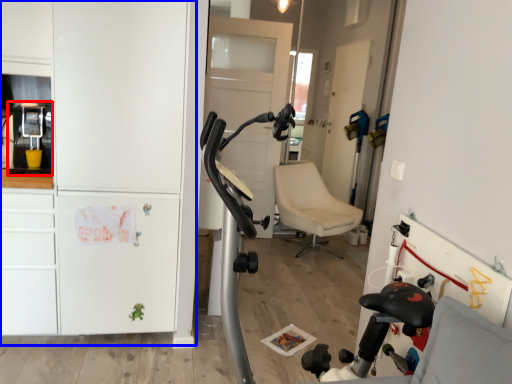
Question: Which object is closer to the camera taking this photo, appliance (highlighted by a red box) or dresser (highlighted by a blue box)?

Choices:
 (A) appliance
 (B) dresser

Answer: (B)